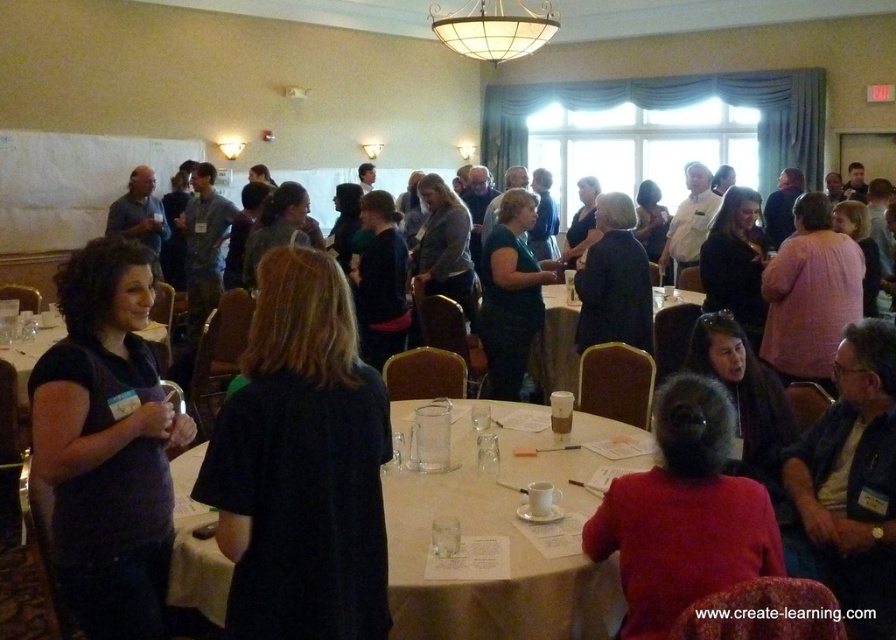
Question: Which of the following is the closest to the observer?

Choices:
 (A) (503, 442)
 (B) (481, 266)

Answer: (A)

Question: Can you confirm if red matte sweater at lower right is positioned to the right of green matte shirt at center?

Choices:
 (A) yes
 (B) no

Answer: (A)

Question: Observing the image, what is the correct spatial positioning of black matte shirt at center in reference to red matte sweater at lower right?

Choices:
 (A) right
 (B) left

Answer: (B)

Question: Is beige fabric table at center bigger than ivory glass chandelier at upper center?

Choices:
 (A) no
 (B) yes

Answer: (B)

Question: Which of the following is the farthest from the observer?

Choices:
 (A) matte black table at lower left
 (B) translucent plastic cup at center
 (C) dark blue shirt at left

Answer: (B)

Question: Considering the real-world distances, which object is farthest from the matte black table at lower left?

Choices:
 (A) dark blue shirt at left
 (B) translucent plastic cup at center

Answer: (B)